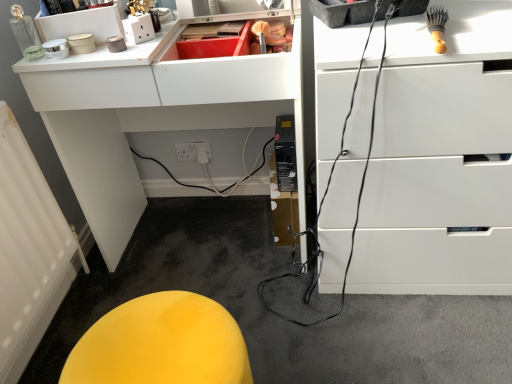
You are a GUI agent. You are given a task and a screenshot of the screen. Output one action in this format:
    pyautogui.click(x=<x>, y=<y>)
    Task: Click on the vacant region below white glossy computer desk at upper center (from a real-world perspective)
    This screenshot has width=512, height=384.
    Given the screenshot: What is the action you would take?
    pyautogui.click(x=215, y=238)